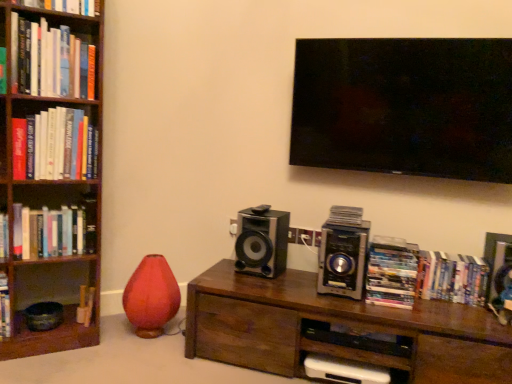
At what (x,y) coordinates should I click in order to perform the action: click on vacant space that is in between wooden bookshelf at left and matte red vase at lower left. Please return your answer as a coordinate pair (x, y). The width and height of the screenshot is (512, 384). Looking at the image, I should click on (102, 332).